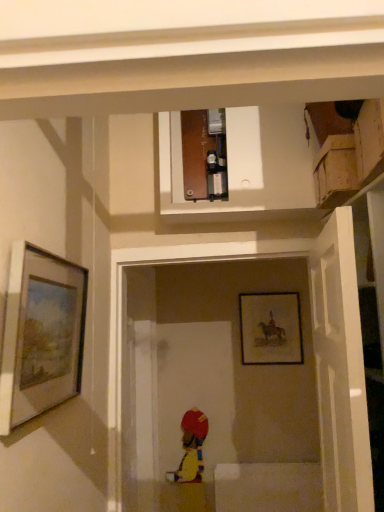
Question: Is matte black picture frame at center, which is counted as the 2th picture frame, starting from the left, outside matte silver picture frame at left, placed as the first picture frame when sorted from left to right?

Choices:
 (A) yes
 (B) no

Answer: (A)

Question: Is matte black picture frame at center, the 1th picture frame from the right, further to camera compared to matte silver picture frame at left, the first picture frame in the front-to-back sequence?

Choices:
 (A) no
 (B) yes

Answer: (B)

Question: Is matte black picture frame at center, the 1th picture frame from the right, to the left of matte silver picture frame at left, placed as the first picture frame when sorted from left to right, from the viewer's perspective?

Choices:
 (A) no
 (B) yes

Answer: (A)

Question: Could matte silver picture frame at left, placed as the first picture frame when sorted from left to right, be considered to be inside matte black picture frame at center, the 1th picture frame from the right?

Choices:
 (A) no
 (B) yes

Answer: (A)

Question: Is matte black picture frame at center, which appears as the second picture frame when viewed from the front, looking in the opposite direction of matte silver picture frame at left, the 2th picture frame in the right-to-left sequence?

Choices:
 (A) yes
 (B) no

Answer: (B)

Question: From a real-world perspective, is matte black picture frame at center, marked as the 1th picture frame in a back-to-front arrangement, under matte silver picture frame at left, the first picture frame in the front-to-back sequence?

Choices:
 (A) yes
 (B) no

Answer: (A)

Question: From a real-world perspective, is matte silver picture frame at left, the 2th picture frame in the right-to-left sequence, physically above white matte door at right?

Choices:
 (A) no
 (B) yes

Answer: (B)

Question: Is matte silver picture frame at left, positioned as the second picture frame in back-to-front order, next to white matte door at right and touching it?

Choices:
 (A) no
 (B) yes

Answer: (A)

Question: Does matte silver picture frame at left, placed as the first picture frame when sorted from left to right, appear on the right side of white matte door at right?

Choices:
 (A) no
 (B) yes

Answer: (A)

Question: Does matte silver picture frame at left, the first picture frame in the front-to-back sequence, come behind white matte door at right?

Choices:
 (A) no
 (B) yes

Answer: (B)

Question: Can you confirm if matte silver picture frame at left, positioned as the second picture frame in back-to-front order, is taller than white matte door at right?

Choices:
 (A) no
 (B) yes

Answer: (A)

Question: Is matte silver picture frame at left, the first picture frame in the front-to-back sequence, completely or partially outside of white matte door at right?

Choices:
 (A) yes
 (B) no

Answer: (A)

Question: Is matte silver picture frame at left, positioned as the second picture frame in back-to-front order, at the back of white matte door at right?

Choices:
 (A) no
 (B) yes

Answer: (A)